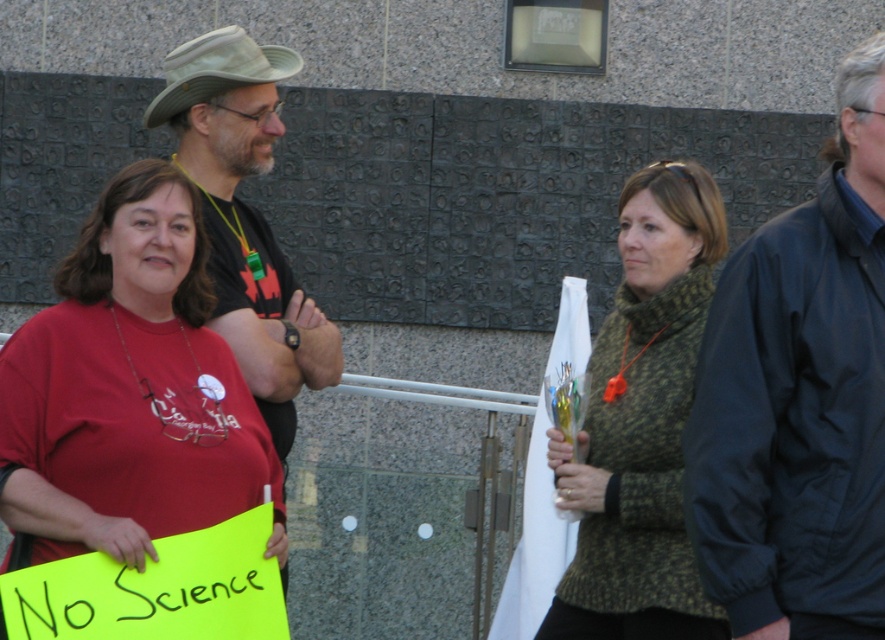
You are a photographer trying to capture a photo of the dark blue jacket at right and the green knitted sweater at center. Which clothing item should you zoom in on to ensure both are in frame without moving the camera?

The dark blue jacket at right has a lesser width compared to green knitted sweater at center, so you should zoom in on the green knitted sweater at center to ensure both are in frame without moving the camera.

You are organizing a clothing donation drive and need to categorize items by size. You have two garments to sort out from the image description provided. The first is the dark blue jacket at right, and the second is the green knitted sweater at center. Based on the description, which garment should be placed in the small size bin?

The dark blue jacket at right has a smaller size compared to the green knitted sweater at center, so it should be placed in the small size bin.